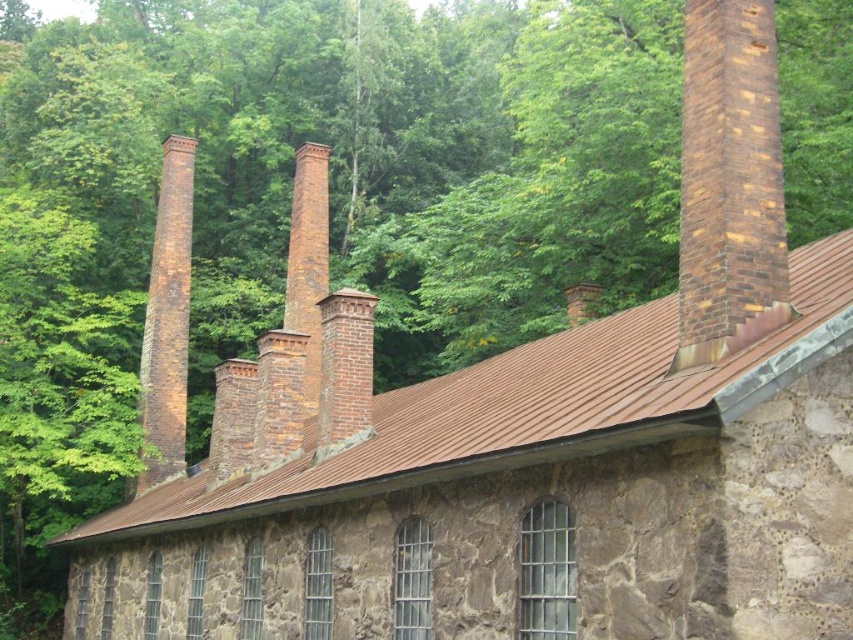
Question: Which object is closer to the camera taking this photo?

Choices:
 (A) brown brick chimney at upper right
 (B) brown brick chimney at left

Answer: (A)

Question: Among these points, which one is nearest to the camera?

Choices:
 (A) (722, 248)
 (B) (175, 182)

Answer: (A)

Question: Which object appears closest to the camera in this image?

Choices:
 (A) brown brick chimney at left
 (B) brown brick chimney at upper right

Answer: (B)

Question: Can you confirm if brown brick chimney at upper right is positioned above brown brick chimney at left?

Choices:
 (A) no
 (B) yes

Answer: (B)

Question: Does brown brick chimney at upper right appear on the right side of brown brick chimney at left?

Choices:
 (A) no
 (B) yes

Answer: (B)

Question: Does brown brick chimney at upper right lie in front of brown brick chimney at left?

Choices:
 (A) no
 (B) yes

Answer: (B)